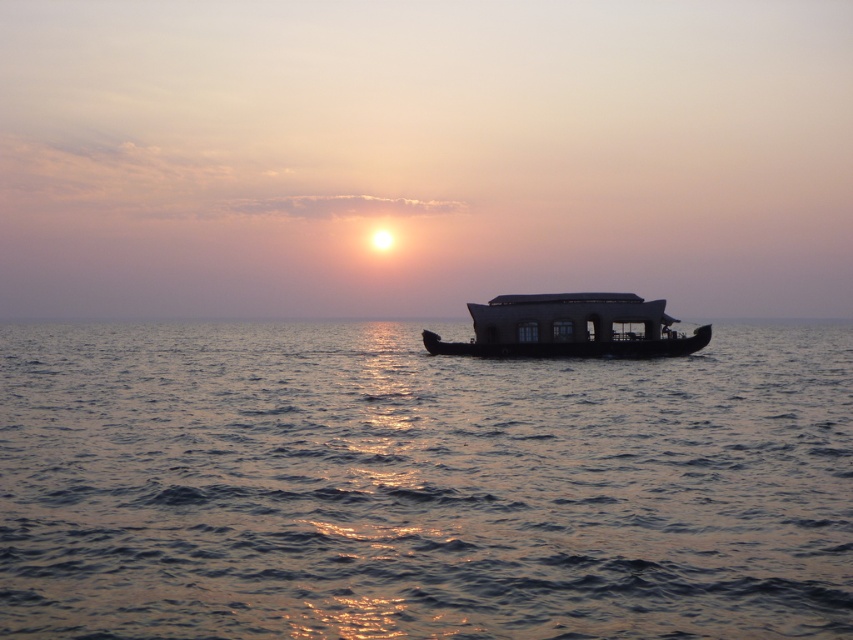
Question: Is blue water at center positioned behind dark brown wooden houseboat at center?

Choices:
 (A) yes
 (B) no

Answer: (B)

Question: Does blue water at center have a smaller size compared to dark brown wooden houseboat at center?

Choices:
 (A) no
 (B) yes

Answer: (A)

Question: Which point appears farthest from the camera in this image?

Choices:
 (A) (625, 349)
 (B) (546, 385)

Answer: (A)

Question: Which object appears closest to the camera in this image?

Choices:
 (A) dark brown wooden houseboat at center
 (B) blue water at center

Answer: (B)

Question: Which point is farther from the camera taking this photo?

Choices:
 (A) (521, 305)
 (B) (688, 392)

Answer: (A)

Question: Can you confirm if blue water at center is positioned to the right of dark brown wooden houseboat at center?

Choices:
 (A) no
 (B) yes

Answer: (A)